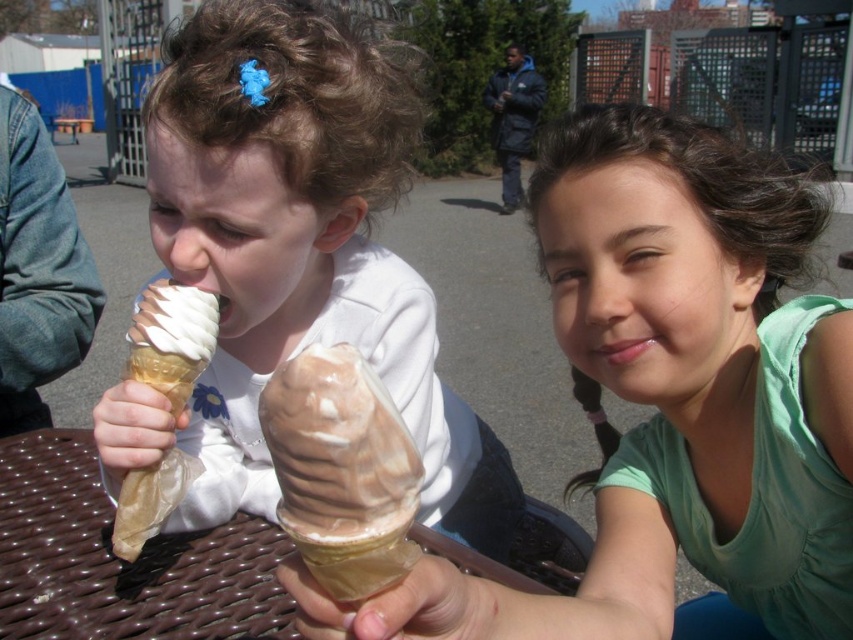
How much distance is there between matte brown ice cream cone at center and vanilla and chocolate ice cream at left?

The distance of matte brown ice cream cone at center from vanilla and chocolate ice cream at left is 16.82 inches.

This screenshot has width=853, height=640. Identify the location of matte brown ice cream cone at center. (671, 396).

What are the coordinates of `matte brown ice cream cone at center` in the screenshot? It's located at (671, 396).

Is point (221, 316) less distant than point (206, 353)?

No, it is not.

Does matte white ice cream cone at left appear on the right side of vanilla and chocolate ice cream at left?

Indeed, matte white ice cream cone at left is positioned on the right side of vanilla and chocolate ice cream at left.

What do you see at coordinates (294, 257) in the screenshot?
I see `matte white ice cream cone at left` at bounding box center [294, 257].

Find the location of a particular element. matte white ice cream cone at left is located at coordinates (294, 257).

Who is taller, matte brown ice cream cone at center or matte white ice cream cone at left?

With more height is matte white ice cream cone at left.

Does point (498, 596) come in front of point (404, 353)?

Yes, it is in front of point (404, 353).

This screenshot has height=640, width=853. In order to click on matte brown ice cream cone at center in this screenshot , I will do `click(671, 396)`.